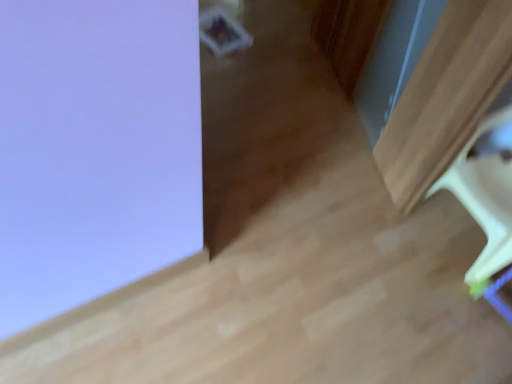
The image size is (512, 384). What do you see at coordinates (486, 210) in the screenshot?
I see `white plastic chair at lower right` at bounding box center [486, 210].

Locate an element on the screen. This screenshot has height=384, width=512. white plastic chair at lower right is located at coordinates click(486, 210).

Where is `white plastic chair at lower right`? The image size is (512, 384). white plastic chair at lower right is located at coordinates (486, 210).